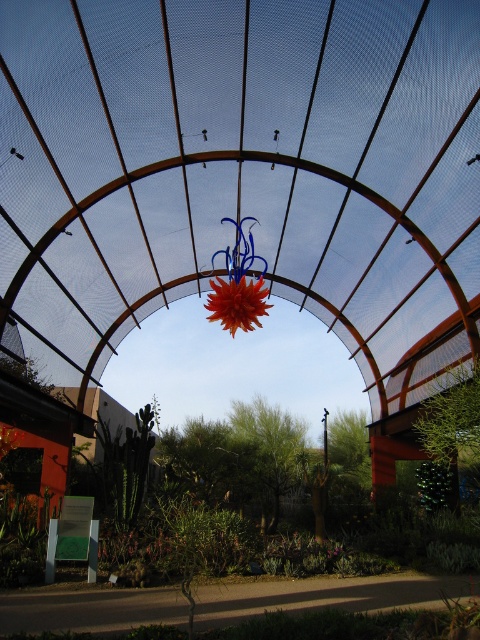
Question: Among these points, which one is farthest from the camera?

Choices:
 (A) (252, 308)
 (B) (247, 202)

Answer: (B)

Question: Does transparent mesh canopy at center come in front of shiny orange flower at center?

Choices:
 (A) yes
 (B) no

Answer: (A)

Question: Which point is closer to the camera?

Choices:
 (A) (384, 109)
 (B) (243, 305)

Answer: (A)

Question: Is transparent mesh canopy at center positioned in front of shiny orange flower at center?

Choices:
 (A) yes
 (B) no

Answer: (A)

Question: Does transparent mesh canopy at center come behind shiny orange flower at center?

Choices:
 (A) no
 (B) yes

Answer: (A)